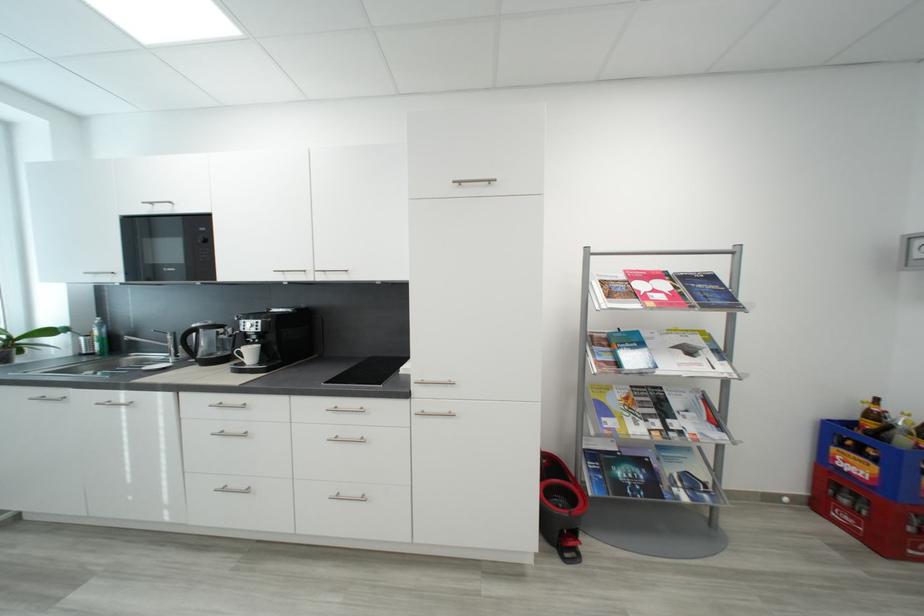
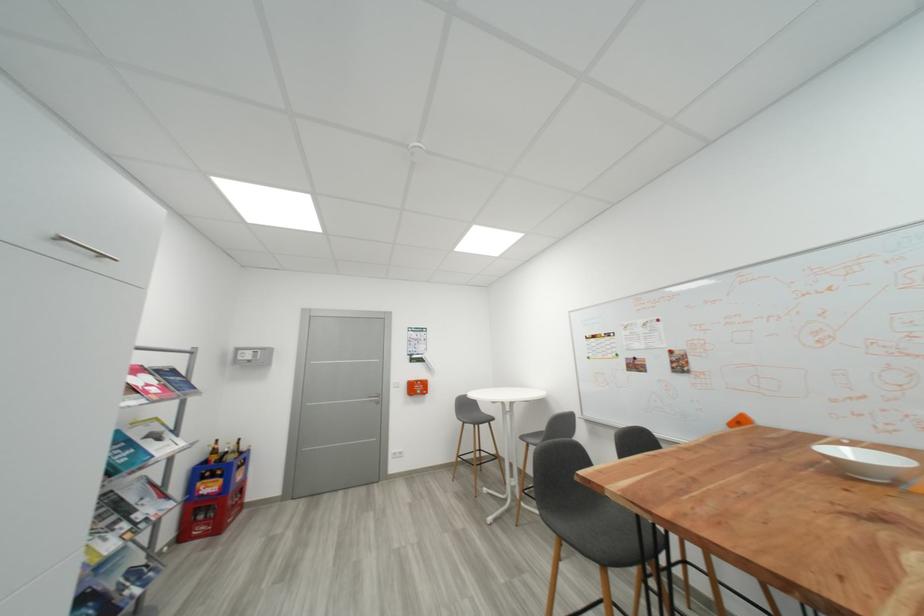
In the second image, find the point that corresponds to (x=881, y=418) in the first image.

(223, 454)